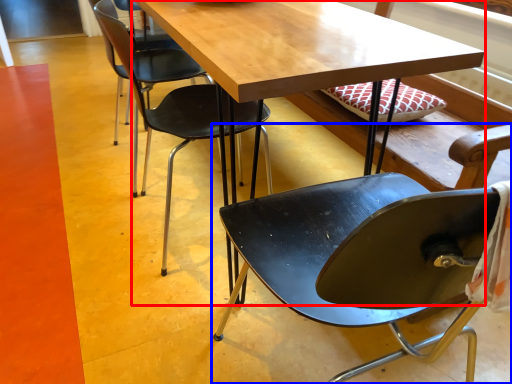
Question: Among these objects, which one is farthest to the camera, table (highlighted by a red box) or chair (highlighted by a blue box)?

Choices:
 (A) table
 (B) chair

Answer: (A)